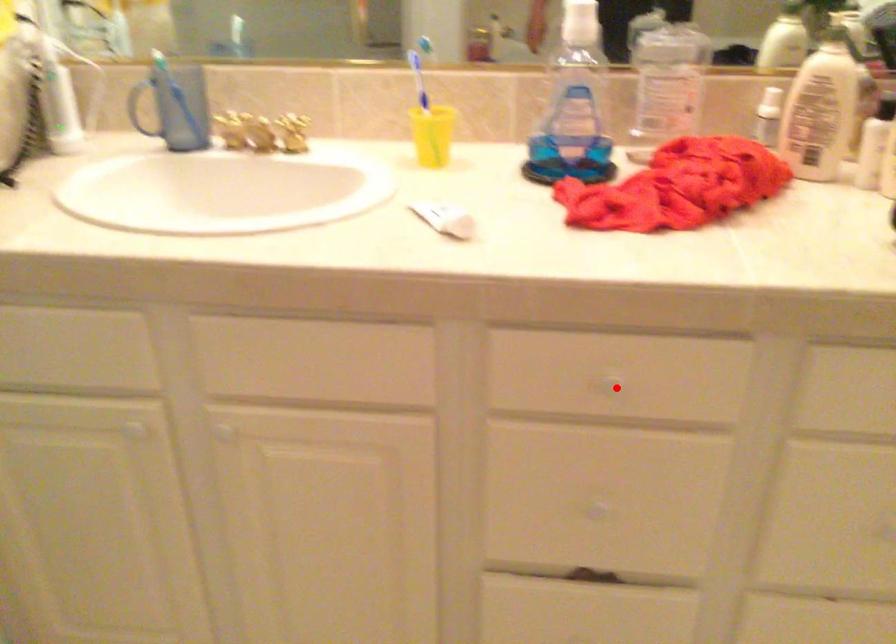
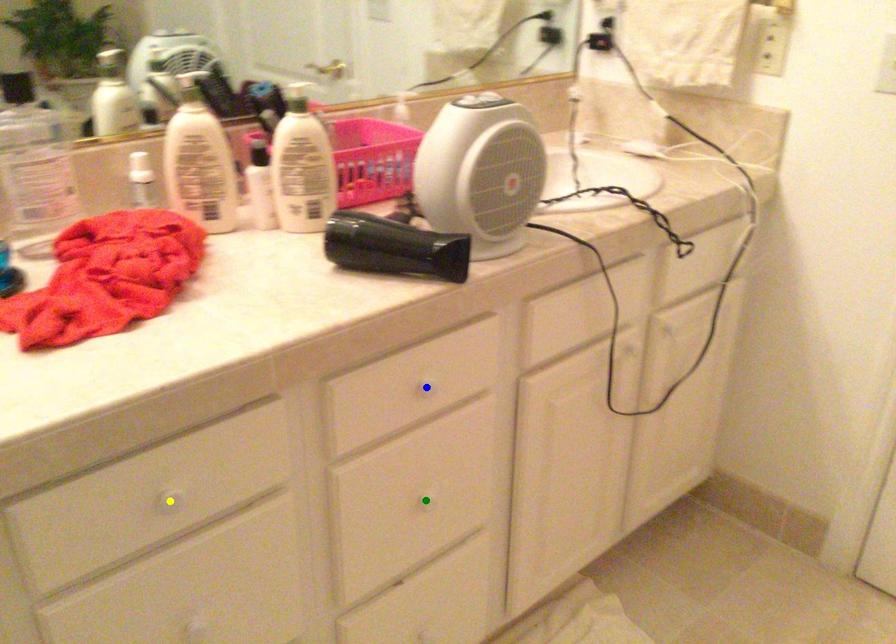
Question: I am providing you with two images of the same scene from different viewpoints. A red point is marked on the first image. You are given multiple points on the second image. Which spot in image 2 lines up with the point in image 1?

Choices:
 (A) green point
 (B) blue point
 (C) yellow point

Answer: (C)